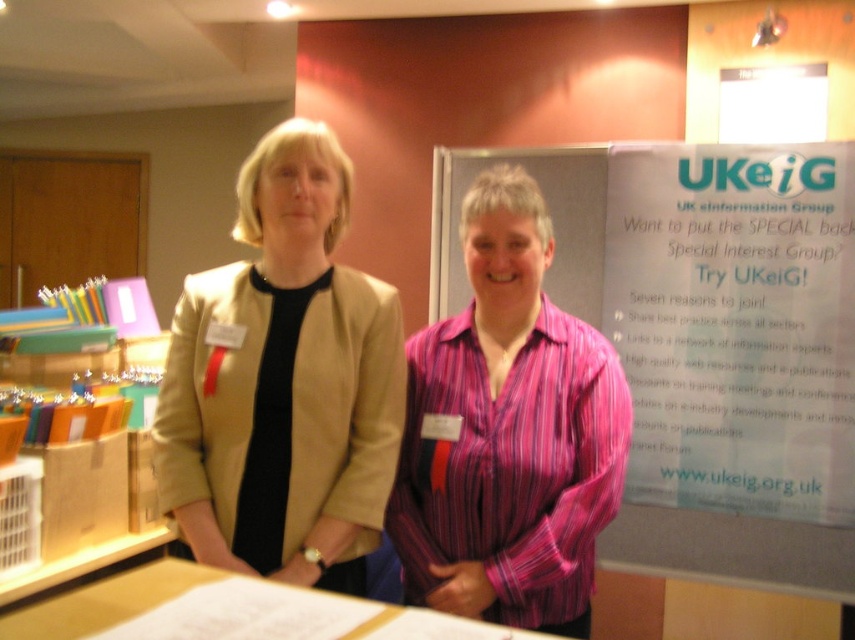
Question: Based on their relative distances, which object is farther from the beige fabric jacket at center?

Choices:
 (A) pink striped shirt at center
 (B) white paper at upper right

Answer: (B)

Question: Considering the relative positions of white paper at upper right and beige fabric jacket at center in the image provided, where is white paper at upper right located with respect to beige fabric jacket at center?

Choices:
 (A) below
 (B) above

Answer: (B)

Question: Is white paperboard at center bigger than beige fabric jacket at center?

Choices:
 (A) yes
 (B) no

Answer: (A)

Question: Considering the real-world distances, which object is farthest from the beige fabric jacket at center?

Choices:
 (A) pink striped shirt at center
 (B) white paperboard at center
 (C) white paper at upper right

Answer: (C)

Question: Which point is farther to the camera?

Choices:
 (A) pink striped shirt at center
 (B) white paper at upper right
 (C) white paperboard at center
 (D) beige fabric jacket at center

Answer: (B)

Question: Is beige fabric jacket at center to the right of pink striped shirt at center from the viewer's perspective?

Choices:
 (A) yes
 (B) no

Answer: (B)